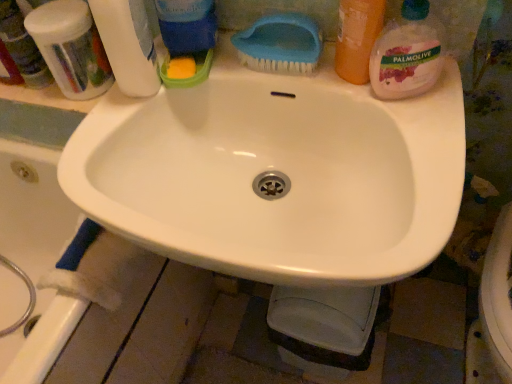
Locate an element on the screen. The height and width of the screenshot is (384, 512). free location in front of palmolive liquid soap at upper right, which appears as the first cleaning product when viewed from the right is located at coordinates (419, 153).